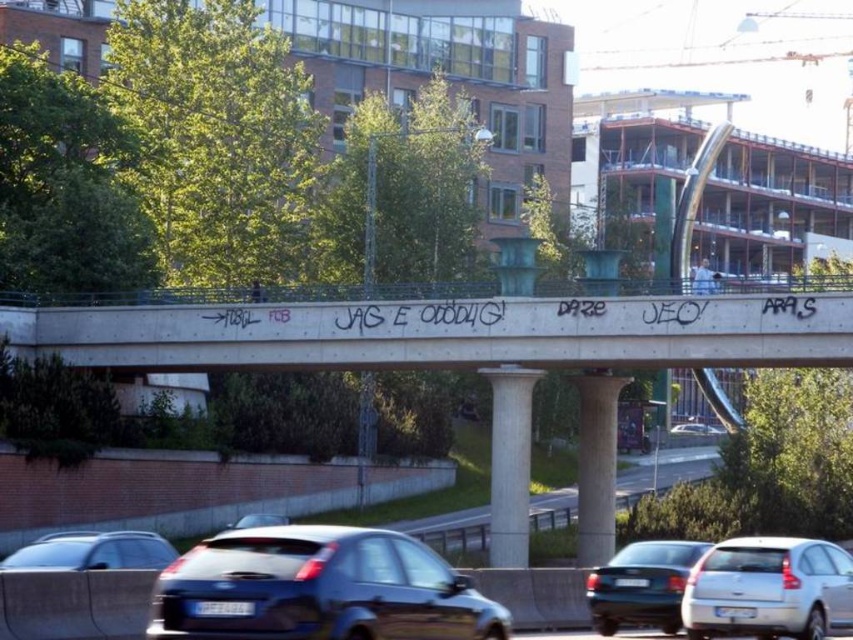
You are a delivery driver who needs to park your metallic blue hatchback at lower center. The parking spot is located at coordinate point 0.920, 0.374. Can you confirm if your car is already parked in the correct spot?

Yes, the metallic blue hatchback at lower center is already parked at the coordinate point [318,588].

You are a pedestrian standing on the bridge and want to cross to the other side. You notice the green asphalt highway at center and the matte black car at lower center. Which object is closer to you as you stand on the bridge?

The matte black car at lower center is closer to you because it is above the green asphalt highway at center, which is located below it.